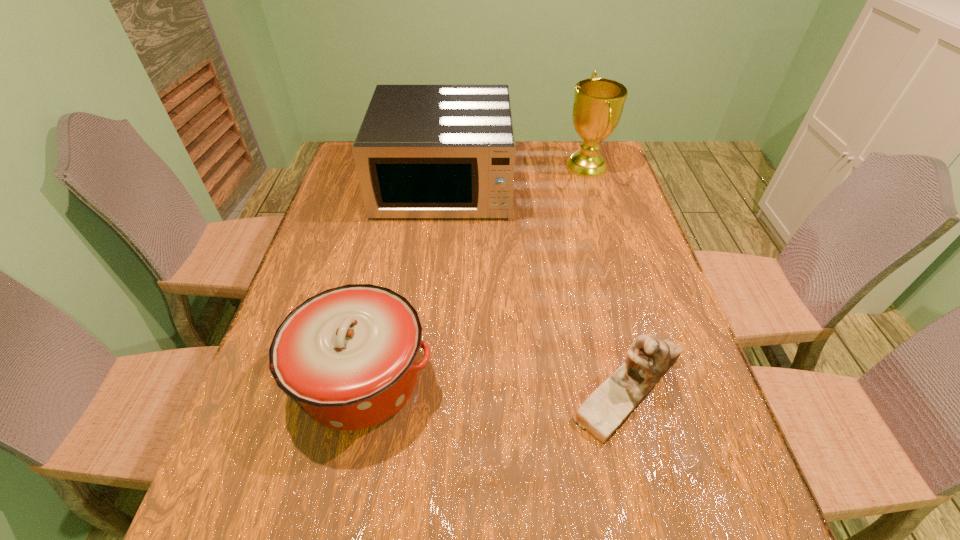
You are a GUI agent. You are given a task and a screenshot of the screen. Output one action in this format:
    pyautogui.click(x=<x>, y=<y>)
    Task: Click on the vacant point located between the figurine and the microwave oven
    
    Given the screenshot: What is the action you would take?
    pyautogui.click(x=536, y=286)

The width and height of the screenshot is (960, 540). Find the location of `blank region between the third tallest object and the award`. blank region between the third tallest object and the award is located at coordinates (474, 273).

This screenshot has height=540, width=960. Identify the location of empty space that is in between the microwave oven and the shortest object. (536, 286).

Find the location of a particular element. This screenshot has height=540, width=960. vacant area that lies between the microwave oven and the shortest object is located at coordinates (536, 286).

This screenshot has width=960, height=540. Find the location of `free area in between the figurine and the microwave oven`. free area in between the figurine and the microwave oven is located at coordinates (536, 286).

Identify which object is the second closest to the award. Please provide its 2D coordinates. Your answer should be formatted as a tuple, i.e. [(x, y)], where the tuple contains the x and y coordinates of a point satisfying the conditions above.

[(648, 359)]

Select which object is the second closest to the award. Please provide its 2D coordinates. Your answer should be formatted as a tuple, i.e. [(x, y)], where the tuple contains the x and y coordinates of a point satisfying the conditions above.

[(648, 359)]

I want to click on vacant region that satisfies the following two spatial constraints: 1. on the shiny surface of the award; 2. with the door open on the microwave oven, so click(591, 184).

At what (x,y) coordinates should I click in order to perform the action: click on free space that satisfies the following two spatial constraints: 1. on the shiny surface of the award; 2. with the door open on the microwave oven. Please return your answer as a coordinate pair (x, y). Image resolution: width=960 pixels, height=540 pixels. Looking at the image, I should click on (x=591, y=184).